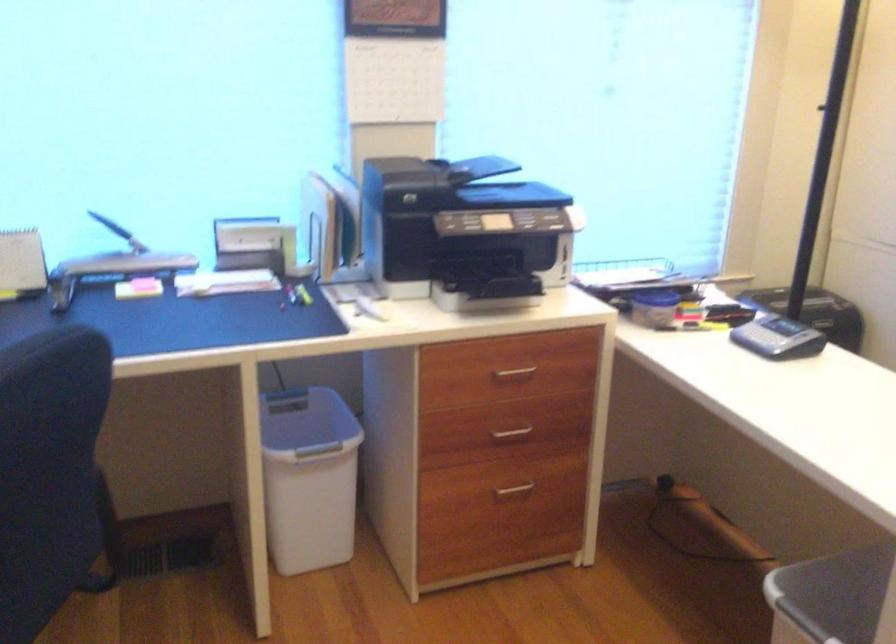
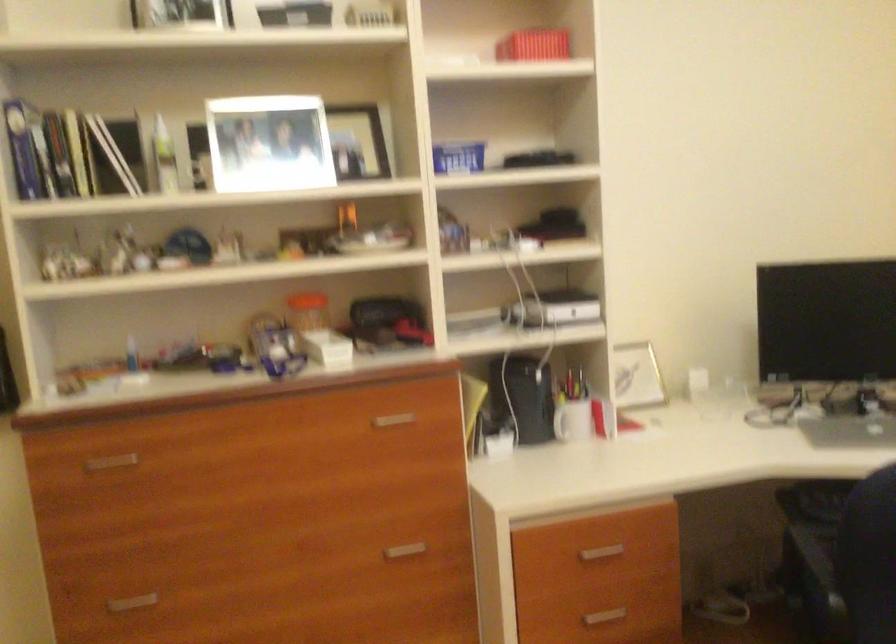
Question: The images are taken continuously from a first-person perspective. In which direction is your viewpoint rotating?

Choices:
 (A) Left
 (B) Right
 (C) Up
 (D) Down

Answer: (A)